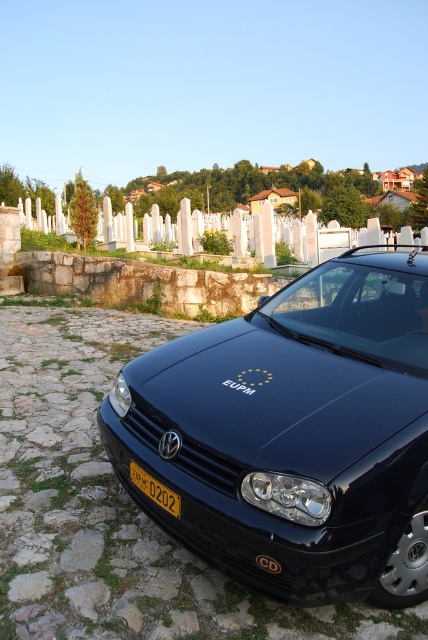
You are a photographer trying to capture the glossy black car at center and the yellow matte license plate at center in a single frame. Since you want to emphasize the car, which object should you focus on first to ensure it appears larger in your photo?

The glossy black car at center has a greater height compared to the yellow matte license plate at center, so focusing on it first will ensure the car appears larger in the photo.

You are a photographer trying to capture the glossy black car at center and the yellow matte license plate at center in a single shot. The camera you are using has a minimum focus distance of 30 inches. Will you be able to focus on both objects clearly?

The glossy black car at center is 29.35 inches from the yellow matte license plate at center. Since the distance between them is less than the camera minimum focus distance of 30 inches, the camera may not be able to focus on both objects clearly.

You are a photographer taking a picture of the glossy black car at center and the yellow matte license plate at center. Which object should you focus on first if you want to capture both in focus without moving the camera?

The glossy black car at center is located above the yellow matte license plate at center. To capture both in focus, you should focus on the glossy black car at center since it is closer to the camera.